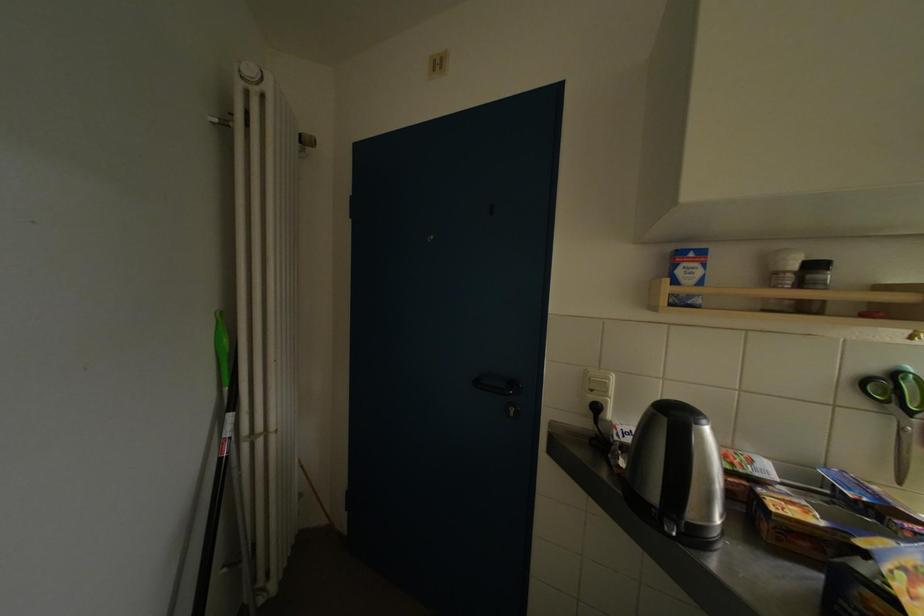
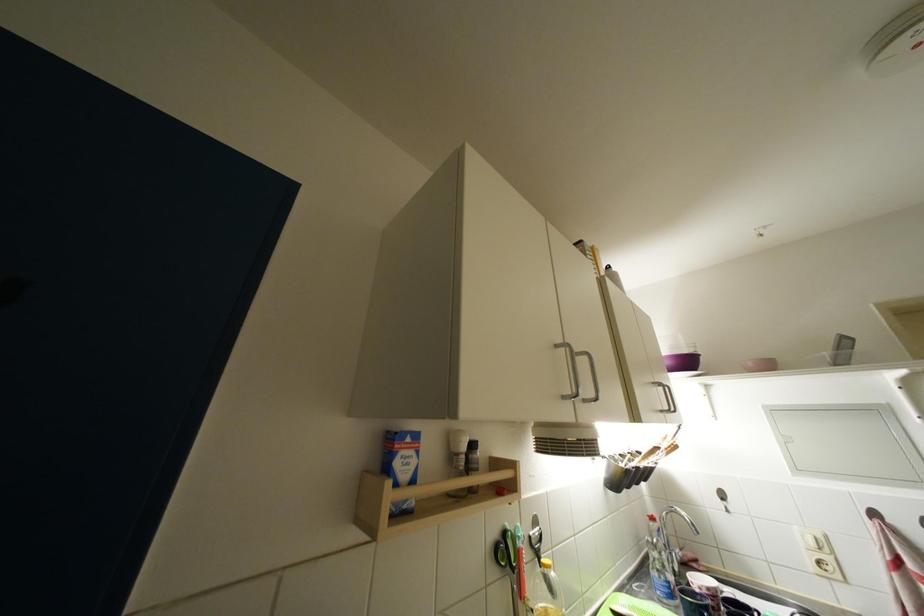
Find the pixel in the second image that matches point (686, 276) in the first image.

(404, 467)